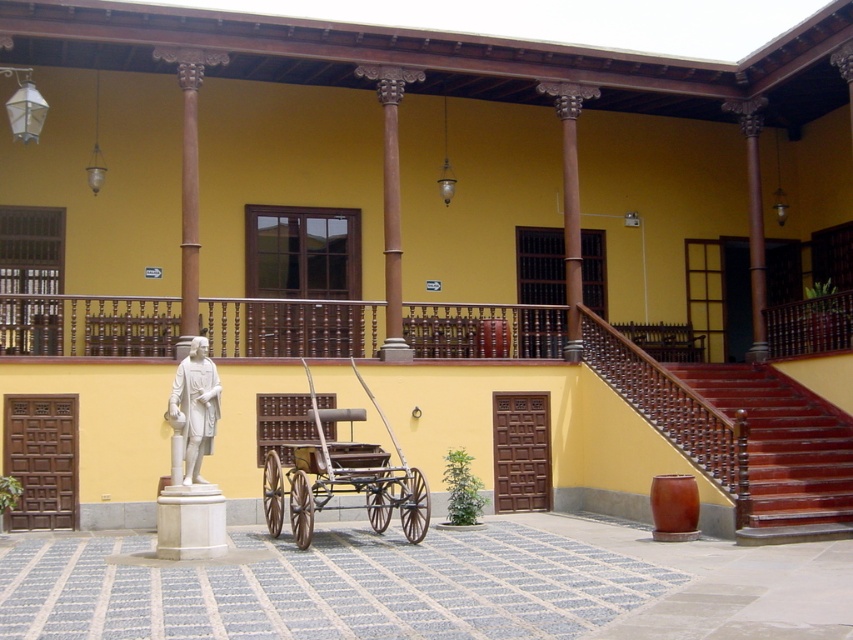
Which is above, shiny red wood stairs at right or white marble statue at center?

white marble statue at center

Does point (734, 376) come behind point (190, 467)?

Yes, it is behind point (190, 467).

Image resolution: width=853 pixels, height=640 pixels. What are the coordinates of `shiny red wood stairs at right` in the screenshot? It's located at (784, 451).

Who is more distant from viewer, (753,433) or (352,486)?

The point (753,433) is more distant.

Is shiny red wood stairs at right shorter than rustic wood cart at center?

Indeed, shiny red wood stairs at right has a lesser height compared to rustic wood cart at center.

What do you see at coordinates (784, 451) in the screenshot?
I see `shiny red wood stairs at right` at bounding box center [784, 451].

Locate an element on the screen. shiny red wood stairs at right is located at coordinates (784, 451).

Is rustic wood cart at center below white marble statue at center?

Indeed, rustic wood cart at center is positioned under white marble statue at center.

Between rustic wood cart at center and white marble statue at center, which one has more height?

rustic wood cart at center

Is point (418, 493) farther from viewer compared to point (207, 445)?

That is True.

This screenshot has width=853, height=640. I want to click on rustic wood cart at center, so click(x=352, y=474).